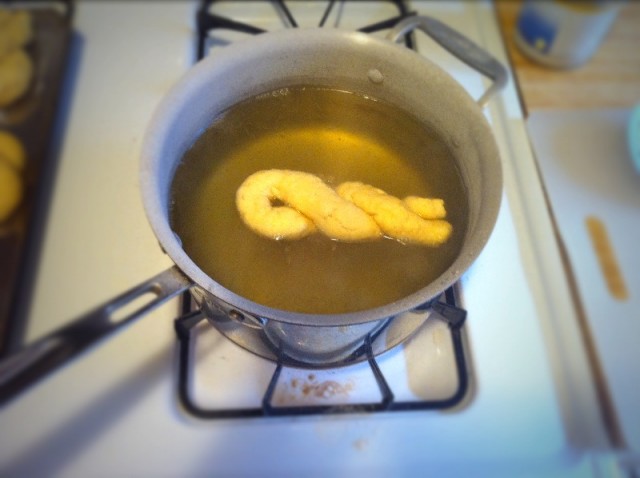
The image size is (640, 478). I want to click on handles, so click(x=89, y=326), click(x=464, y=41).